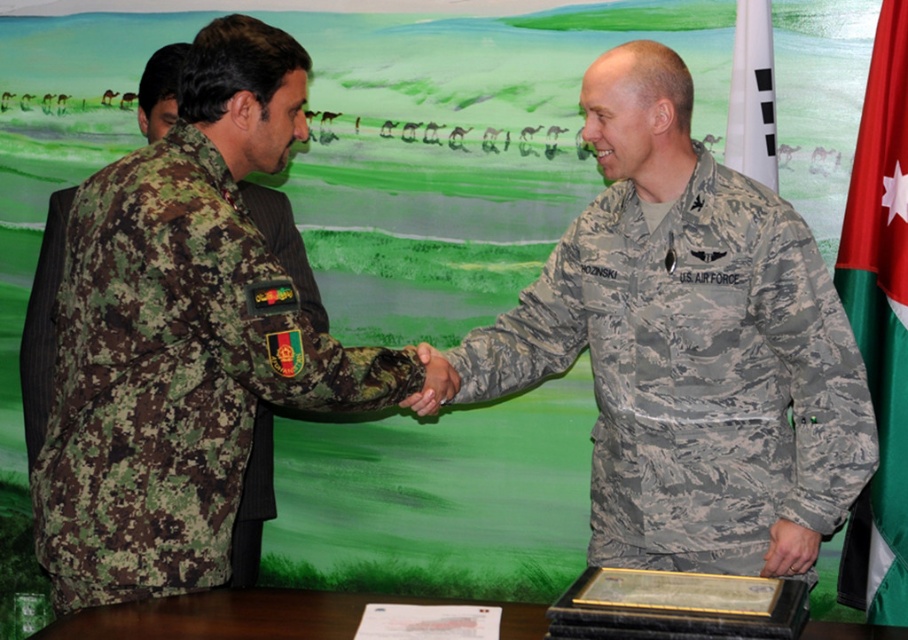
Question: Which point is farther to the camera?

Choices:
 (A) camouflage fabric us air force uniform at center
 (B) white fabric flag at upper right
 (C) green fabric flag at right
 (D) camouflage fabric uniform at left

Answer: (B)

Question: Which point is farther to the camera?

Choices:
 (A) (903, 113)
 (B) (141, 333)
 (C) (768, 104)
 (D) (648, 460)

Answer: (C)

Question: Is camouflage fabric us air force uniform at center closer to the viewer compared to white fabric flag at upper right?

Choices:
 (A) yes
 (B) no

Answer: (A)

Question: Is camouflage fabric uniform at left above green fabric flag at right?

Choices:
 (A) yes
 (B) no

Answer: (B)

Question: Among these points, which one is farthest from the camera?

Choices:
 (A) (500, 388)
 (B) (147, 266)
 (C) (763, 106)
 (D) (869, 502)

Answer: (C)

Question: Does camouflage fabric uniform at left appear on the right side of green fabric flag at right?

Choices:
 (A) no
 (B) yes

Answer: (A)